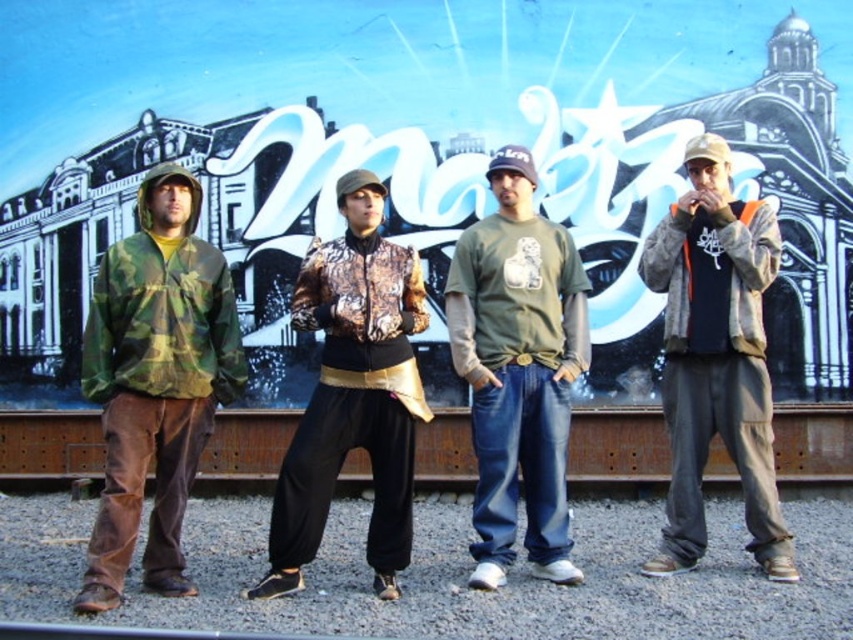
You are standing in front of the mural and want to take a photo of the camouflage fabric jacket at left. Where should you aim your camera to capture it?

You should aim your camera at the point with coordinates [155,381] to capture the camouflage fabric jacket at left.